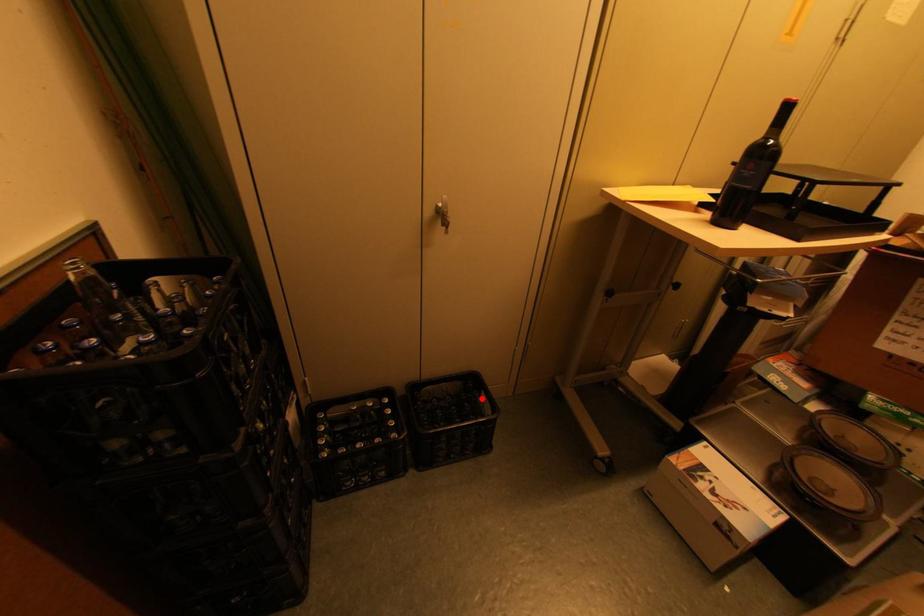
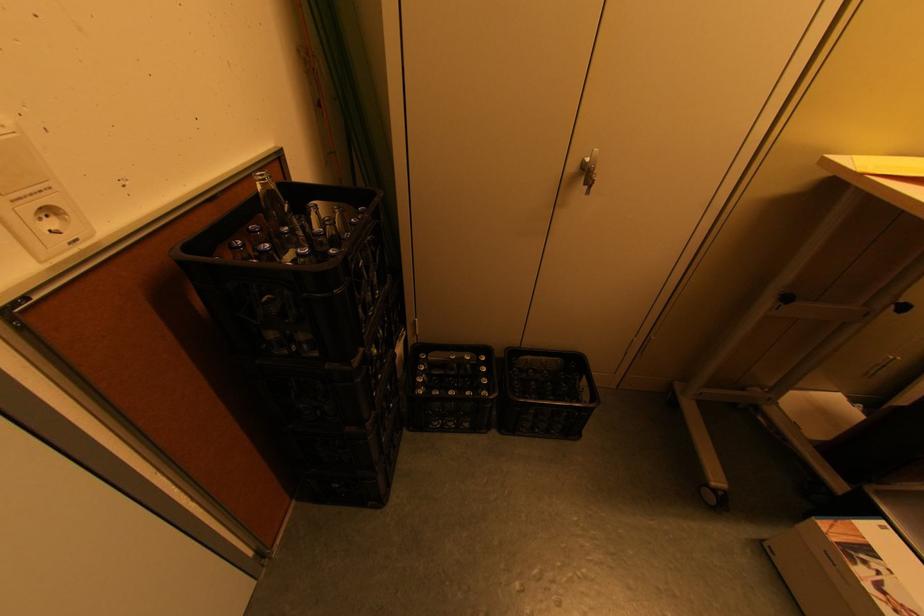
Question: I am providing you with two images of the same scene from different viewpoints. In image1, a red point is highlighted. Considering the same 3D point in image2, which of the following is correct?

Choices:
 (A) It is closer
 (B) It is farther

Answer: (A)